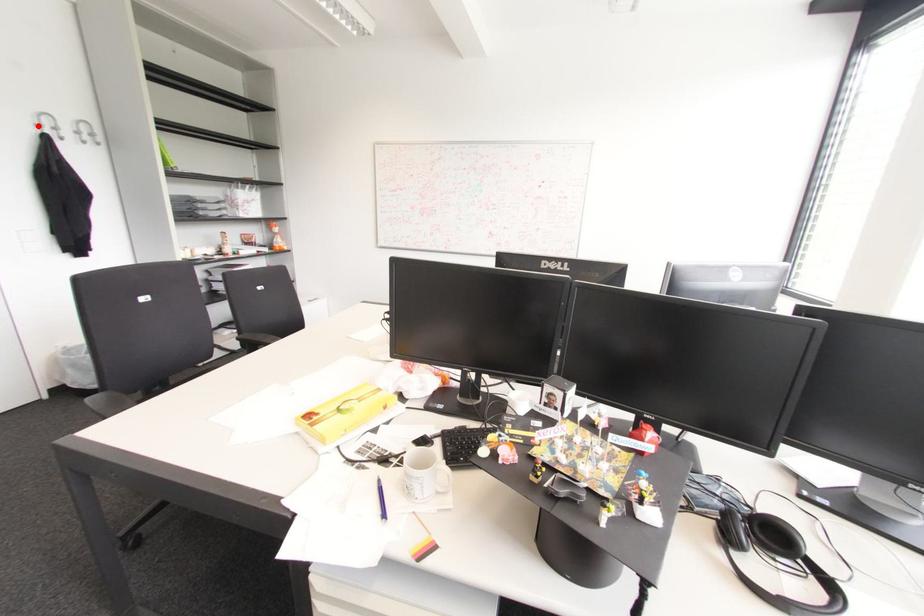
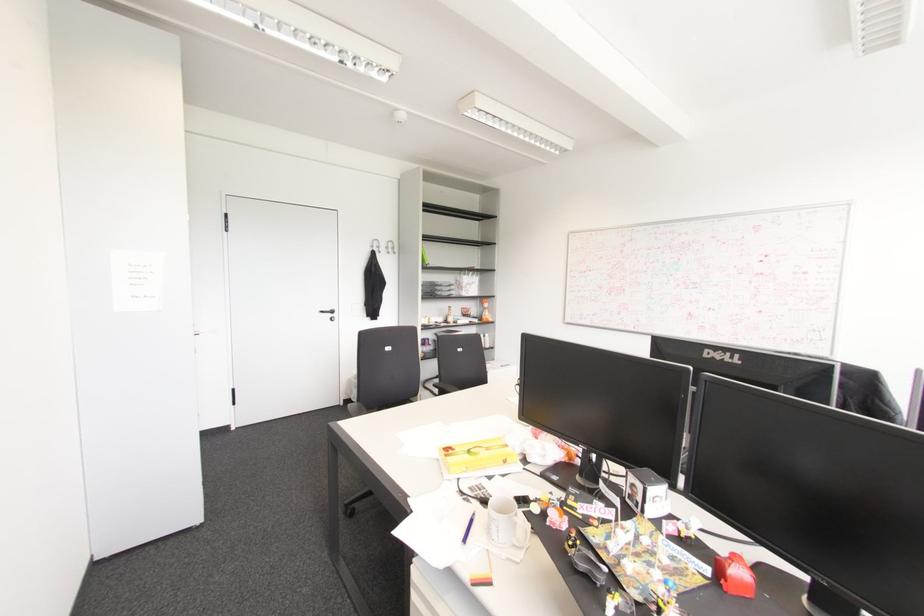
The point at the highlighted location is marked in the first image. Where is the corresponding point in the second image?

(371, 246)